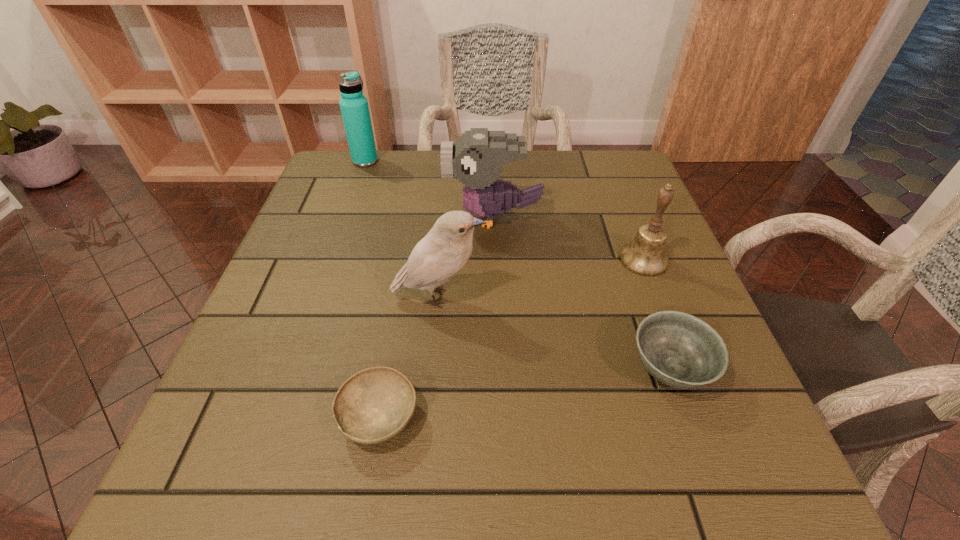
Where is `blank space located 0.350m at the beak of the farther bird`? blank space located 0.350m at the beak of the farther bird is located at coordinates (299, 217).

Locate an element on the screen. free space located 0.260m at the beak of the farther bird is located at coordinates (337, 217).

Locate an element on the screen. vacant space located at the beak of the farther bird is located at coordinates pos(383,217).

You are a GUI agent. You are given a task and a screenshot of the screen. Output one action in this format:
    pyautogui.click(x=<x>, y=<y>)
    Task: Click on the free spot located 0.350m at the beak of the third nearest object
    
    Given the screenshot: What is the action you would take?
    pyautogui.click(x=663, y=297)

I want to click on blank space located 0.190m on the back of the bell, so click(618, 194).

The width and height of the screenshot is (960, 540). Find the location of `blank area located 0.080m on the back of the second shortest object`. blank area located 0.080m on the back of the second shortest object is located at coordinates (646, 302).

At what (x,y) coordinates should I click in order to perform the action: click on vacant space located 0.170m on the back of the shorter bowl. Please return your answer as a coordinate pair (x, y). This screenshot has height=540, width=960. Looking at the image, I should click on (398, 305).

Where is `object positioned at the far edge`? This screenshot has height=540, width=960. object positioned at the far edge is located at coordinates (354, 107).

Find the location of a particular element. The height and width of the screenshot is (540, 960). object present at the near edge is located at coordinates (375, 404).

Find the location of a particular element. This screenshot has width=960, height=540. object present at the left edge is located at coordinates (354, 107).